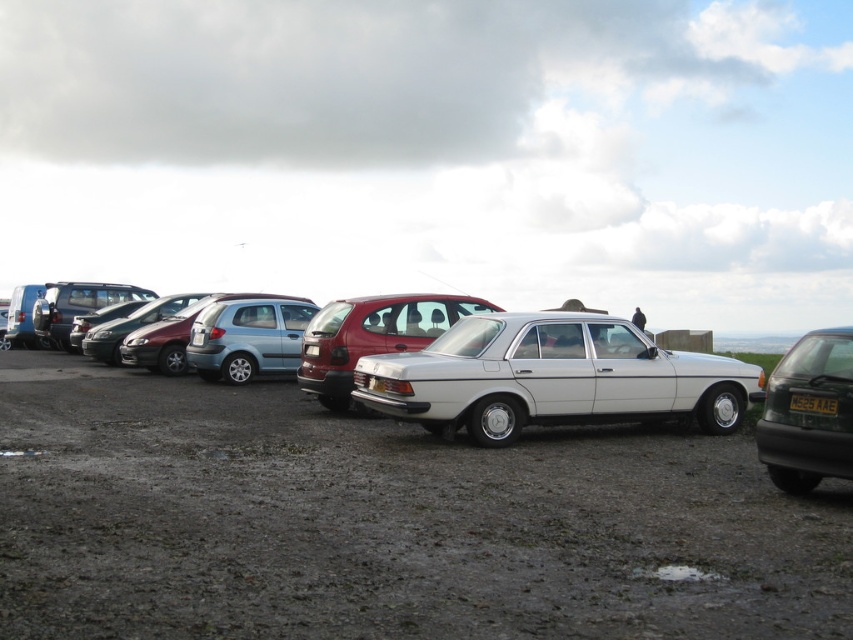
Question: Is dirt track at center closer to the viewer compared to white metallic sedan at center?

Choices:
 (A) yes
 (B) no

Answer: (A)

Question: Which object appears farthest from the camera in this image?

Choices:
 (A) white plastic license plate at center
 (B) dirt track at center

Answer: (A)

Question: Which is farther from the white plastic license plate at center?

Choices:
 (A) metallic blue sedan at center
 (B) metallic red hatchback at center

Answer: (A)

Question: Observing the image, what is the correct spatial positioning of matte black car at right in reference to metallic blue sedan at center?

Choices:
 (A) above
 (B) below

Answer: (B)

Question: Which point is farther to the camera?

Choices:
 (A) (302, 484)
 (B) (276, 368)

Answer: (B)

Question: Can you confirm if white metallic sedan at center is thinner than white plastic license plate at center?

Choices:
 (A) no
 (B) yes

Answer: (A)